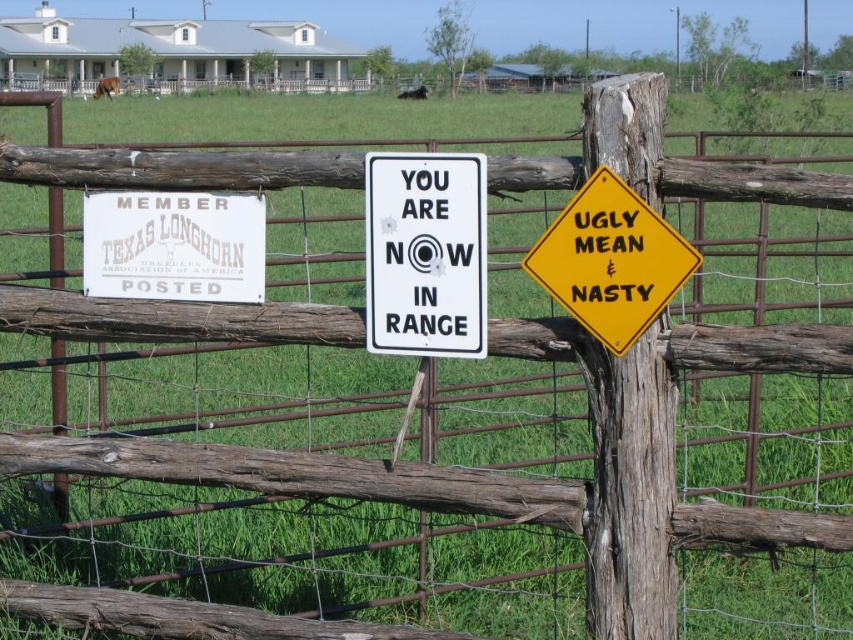
Question: Which of the following is the farthest from the observer?

Choices:
 (A) white paper sign at center
 (B) yellow diamond-shaped sign at upper right

Answer: (A)

Question: Where is white paper sign at center located in relation to yellow diamond-shaped sign at upper right in the image?

Choices:
 (A) above
 (B) below

Answer: (B)

Question: Does white matte sign at upper left appear over yellow diamond-shaped sign at upper right?

Choices:
 (A) yes
 (B) no

Answer: (A)

Question: Can you confirm if white paper sign at center is thinner than white matte sign at upper left?

Choices:
 (A) no
 (B) yes

Answer: (B)

Question: Which object appears farthest from the camera in this image?

Choices:
 (A) yellow diamond-shaped sign at upper right
 (B) white matte sign at upper left
 (C) white paper sign at center

Answer: (B)

Question: Estimate the real-world distances between objects in this image. Which object is closer to the white matte sign at upper left?

Choices:
 (A) yellow diamond-shaped sign at upper right
 (B) white paper sign at center

Answer: (B)